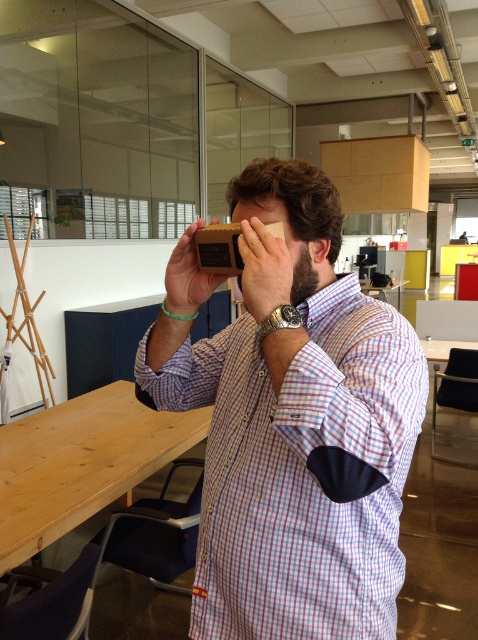
Consider the image. Between wooden table at lower left and matte brown wooden block at center, which one has more height?

wooden table at lower left is taller.

This screenshot has height=640, width=478. What are the coordinates of `wooden table at lower left` in the screenshot? It's located at (82, 461).

Who is more forward, (294,291) or (178,275)?

Positioned in front is point (294,291).

This screenshot has height=640, width=478. I want to click on wooden block at center, so 293,196.

In order to click on wooden block at center in this screenshot , I will do `click(293, 196)`.

Where is `wooden block at center`? wooden block at center is located at coordinates (x=293, y=196).

Who is taller, matte wooden box at center or matte brown wooden block at center?

With more height is matte wooden box at center.

The height and width of the screenshot is (640, 478). Describe the element at coordinates (296, 435) in the screenshot. I see `matte wooden box at center` at that location.

In the scene shown: Who is more forward, (310,614) or (261,317)?

Point (261,317)

Locate an element on the screen. The image size is (478, 640). matte wooden box at center is located at coordinates (296, 435).